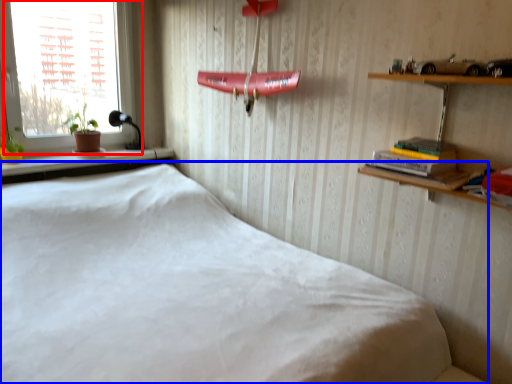
Question: Which object appears farthest to the camera in this image, window (highlighted by a red box) or bed (highlighted by a blue box)?

Choices:
 (A) window
 (B) bed

Answer: (A)